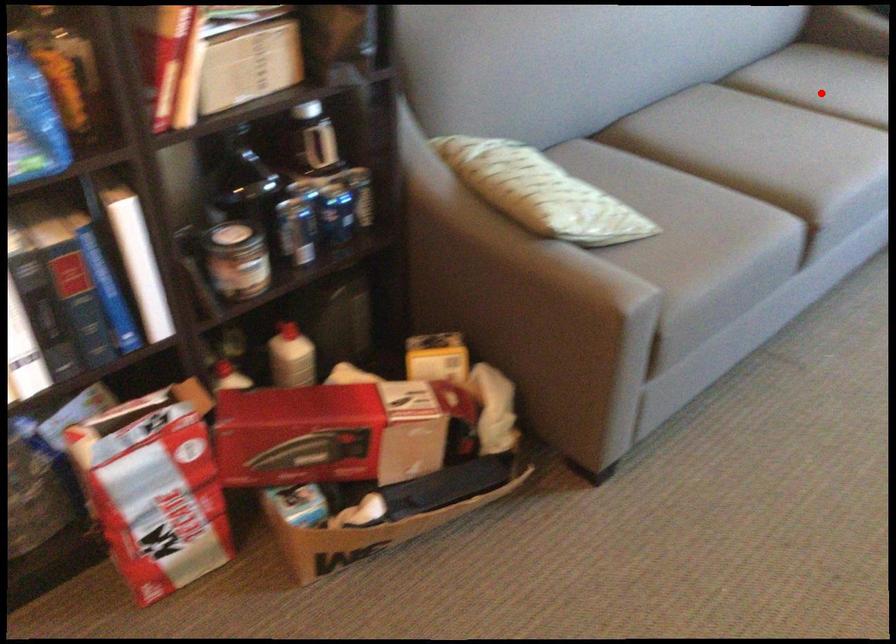
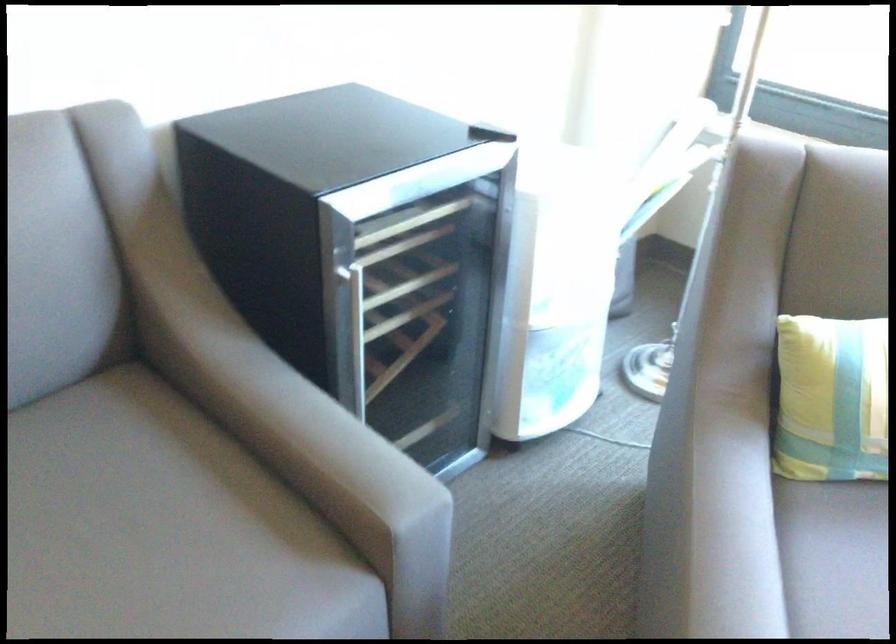
The point at the highlighted location is marked in the first image. Where is the corresponding point in the second image?

(83, 529)